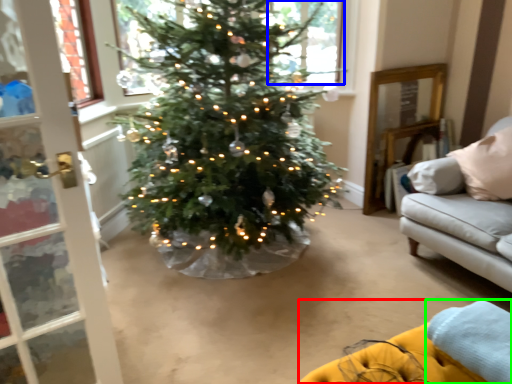
Question: Based on their relative distances, which object is nearer to couch (highlighted by a red box)? Choose from window (highlighted by a blue box) and blanket (highlighted by a green box).

Choices:
 (A) window
 (B) blanket

Answer: (B)